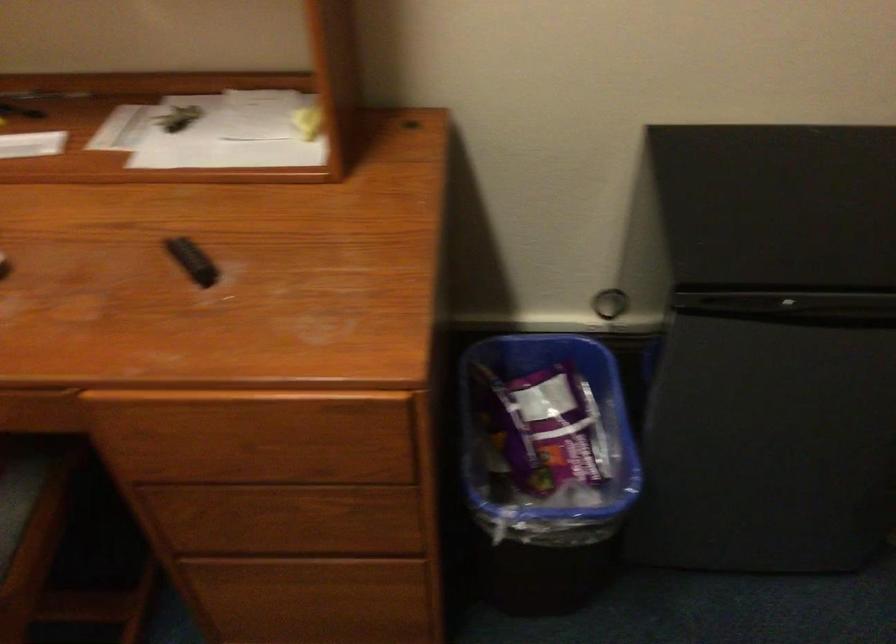
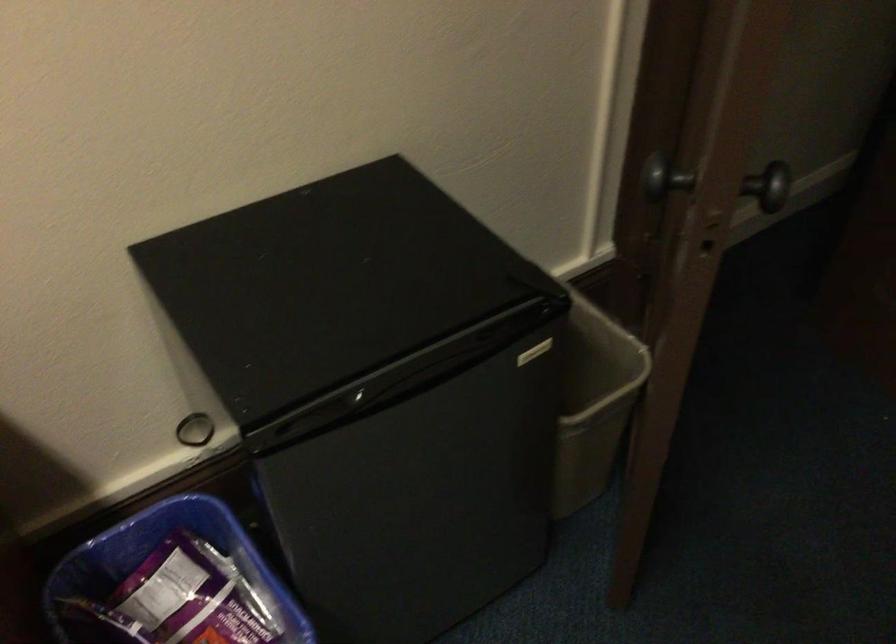
Question: The first image is from the beginning of the video and the second image is from the end. How did the camera likely rotate when shooting the video?

Choices:
 (A) Left
 (B) Right
 (C) Up
 (D) Down

Answer: (B)